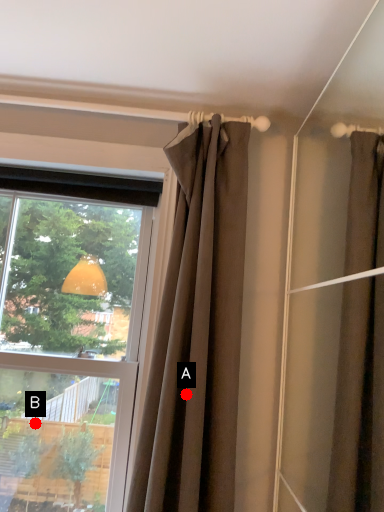
Question: Two points are circled on the image, labeled by A and B beside each circle. Among these points, which one is farthest from the camera?

Choices:
 (A) A is further
 (B) B is further

Answer: (B)